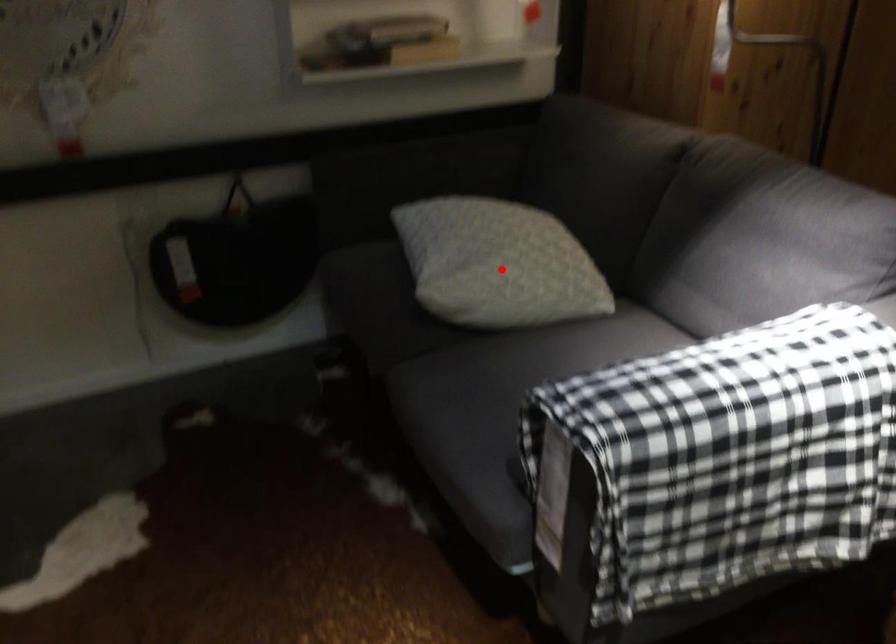
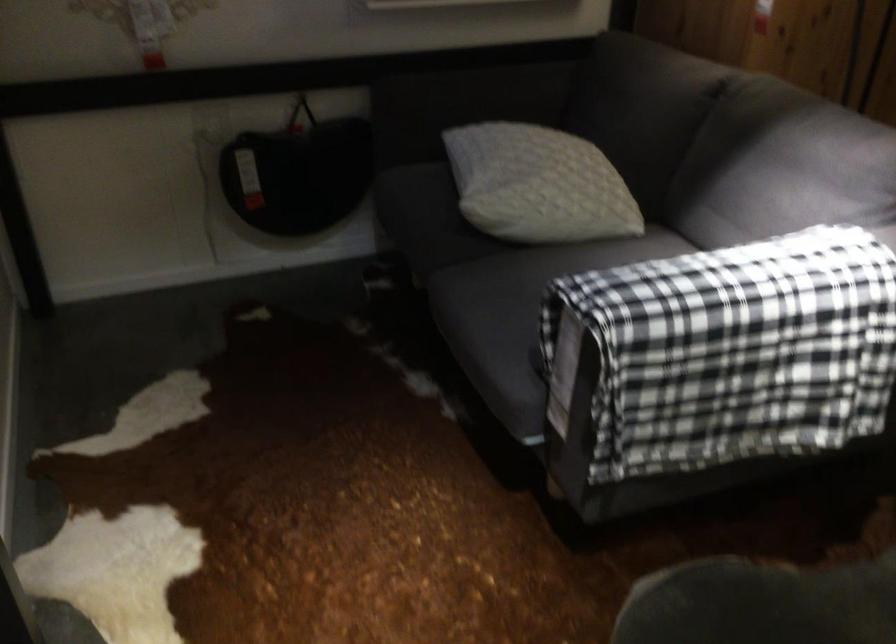
Where in the second image is the point corresponding to the highlighted location from the first image?

(538, 185)